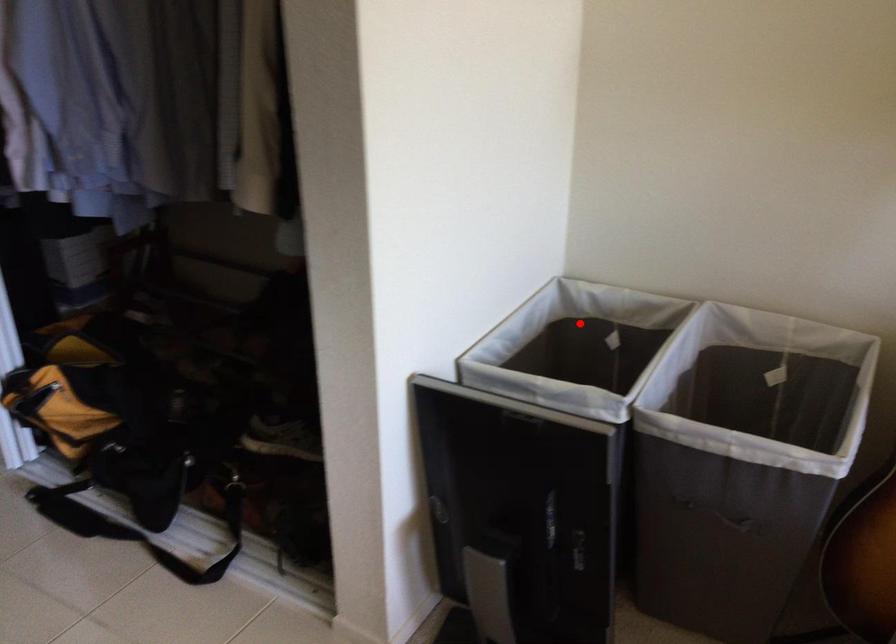
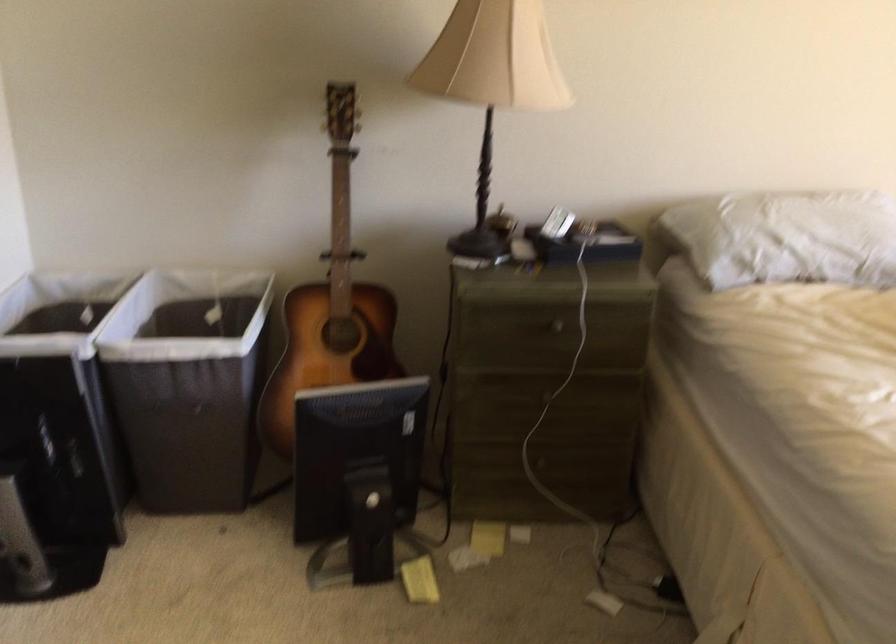
Question: A red point is marked in image1. In image2, is the corresponding 3D point closer to the camera or farther? Reply with the corresponding letter.

Choices:
 (A) The corresponding 3D point is closer.
 (B) The corresponding 3D point is farther.

Answer: (B)